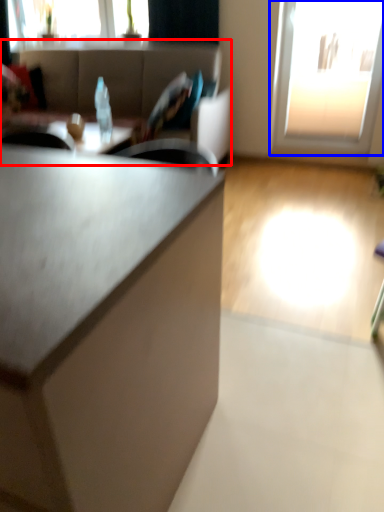
Question: Which of the following is the farthest to the observer, studio couch (highlighted by a red box) or window (highlighted by a blue box)?

Choices:
 (A) studio couch
 (B) window

Answer: (B)